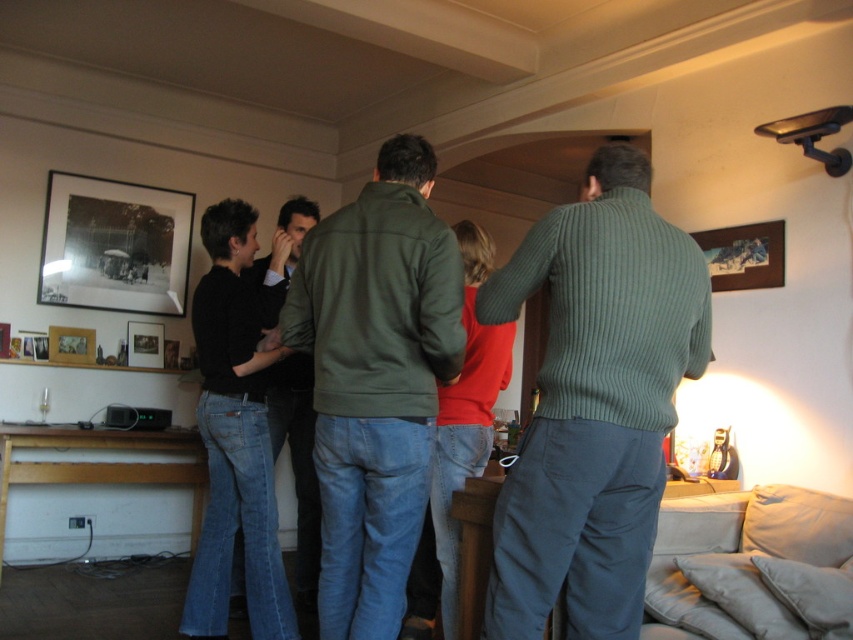
You are a photographer taking a picture of the ribbed green sweater at center and the black matte picture frame at upper left. Which object will appear larger in your photo?

The ribbed green sweater at center will appear larger in the photo because it is closer to the viewer than the black matte picture frame at upper left.